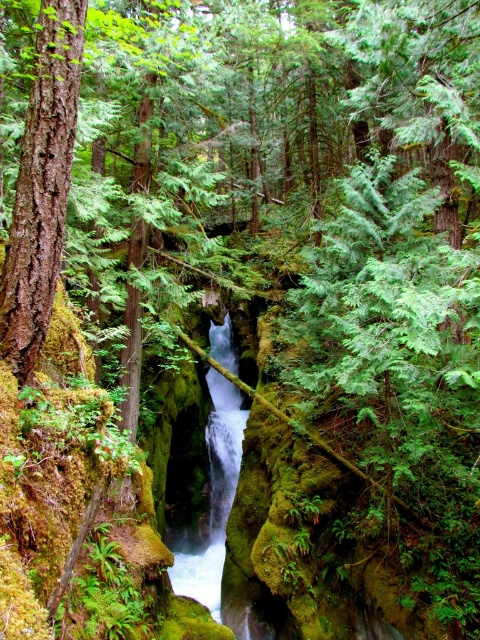
Question: Which point is farther to the camera?

Choices:
 (A) (222, 508)
 (B) (75, 1)

Answer: (A)

Question: Does smooth brown bark at left have a larger size compared to white glossy stream at center?

Choices:
 (A) no
 (B) yes

Answer: (A)

Question: Among these points, which one is farthest from the camera?

Choices:
 (A) (43, 276)
 (B) (204, 573)

Answer: (B)

Question: Is smooth brown bark at left in front of white glossy stream at center?

Choices:
 (A) yes
 (B) no

Answer: (A)

Question: Does smooth brown bark at left come in front of white glossy stream at center?

Choices:
 (A) yes
 (B) no

Answer: (A)